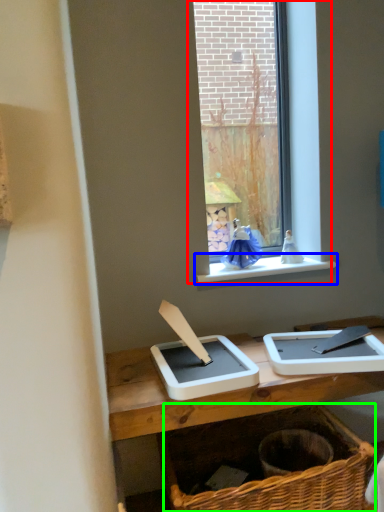
Question: Estimate the real-world distances between objects in this image. Which object is closer to window (highlighted by a red box), window sill (highlighted by a blue box) or basket (highlighted by a green box)?

Choices:
 (A) window sill
 (B) basket

Answer: (A)